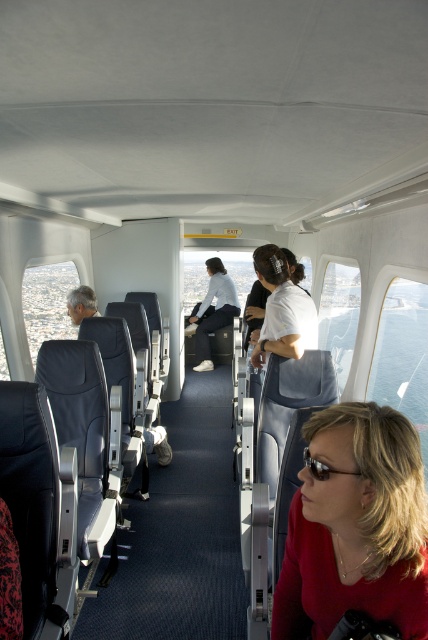
Is matte red shirt at lower right behind light blue fabric jacket at center?

No.

Is matte red shirt at lower right thinner than light blue fabric jacket at center?

Correct, matte red shirt at lower right's width is less than light blue fabric jacket at center's.

Is point (314, 568) closer to camera compared to point (219, 285)?

Yes.

Image resolution: width=428 pixels, height=640 pixels. In order to click on matte red shirt at lower right in this screenshot , I will do `click(356, 525)`.